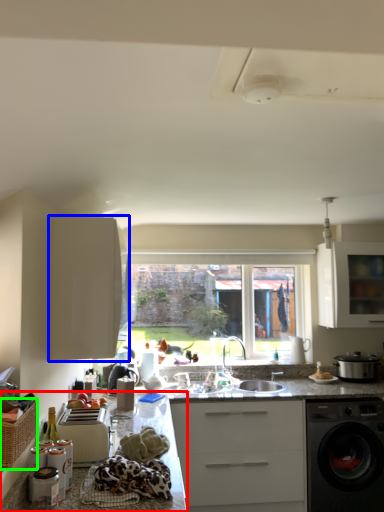
Question: Based on their relative distances, which object is nearer to countertop (highlighted by a red box)? Choose from cabinetry (highlighted by a blue box) and basket (highlighted by a green box).

Choices:
 (A) cabinetry
 (B) basket

Answer: (A)